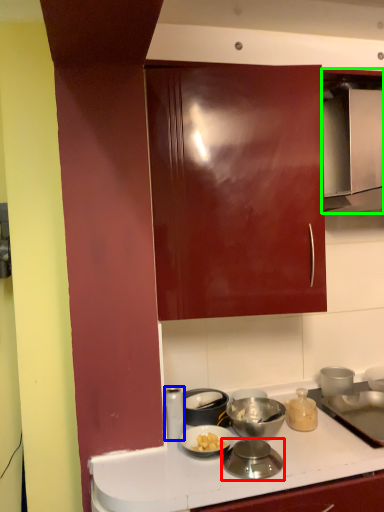
Question: Which object is positioned farthest from kitchen appliance (highlighted by a red box)? Select from kitchen appliance (highlighted by a blue box) and home appliance (highlighted by a green box).

Choices:
 (A) kitchen appliance
 (B) home appliance

Answer: (B)